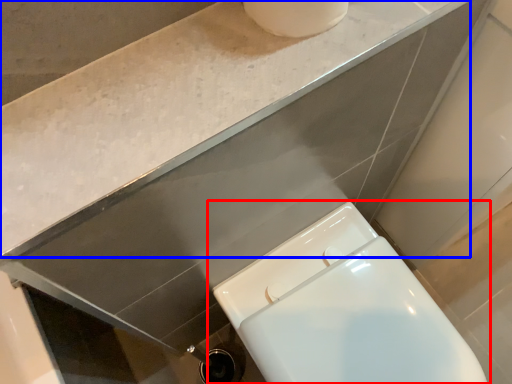
Question: Which of the following is the closest to the observer, toilet (highlighted by a red box) or counter top (highlighted by a blue box)?

Choices:
 (A) toilet
 (B) counter top

Answer: (B)